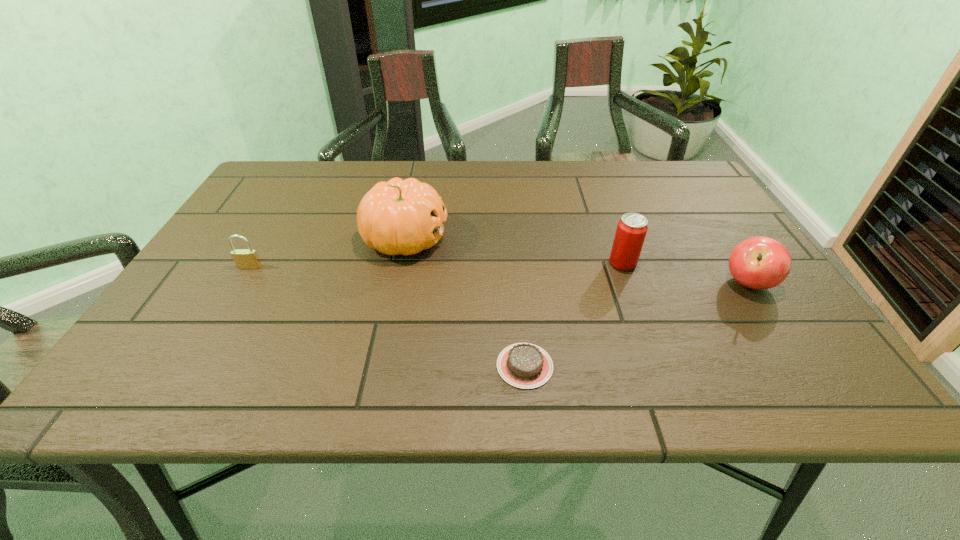
Where is `free space between the fourth object from left to right and the padlock`? Image resolution: width=960 pixels, height=540 pixels. free space between the fourth object from left to right and the padlock is located at coordinates (436, 265).

The width and height of the screenshot is (960, 540). Identify the location of free space between the fourth object from left to right and the rightmost object. (685, 273).

This screenshot has width=960, height=540. Identify the location of unoccupied position between the second shortest object and the rightmost object. (499, 275).

Locate an element on the screen. vacant area between the apple and the fourth object from left to right is located at coordinates (685, 273).

Locate an element on the screen. The height and width of the screenshot is (540, 960). free space between the nearest object and the apple is located at coordinates (636, 325).

At what (x,y) coordinates should I click in order to perform the action: click on empty space that is in between the pumpkin and the shortest object. Please return your answer as a coordinate pair (x, y). Looking at the image, I should click on (465, 302).

Where is `free spot between the shortest object and the fourth object from left to right`? free spot between the shortest object and the fourth object from left to right is located at coordinates (574, 314).

This screenshot has width=960, height=540. Identify the location of free space that is in between the can and the pumpkin. (514, 251).

Find the location of a particular element. The image size is (960, 540). vacant point located between the tallest object and the nearest object is located at coordinates (465, 302).

This screenshot has height=540, width=960. I want to click on vacant region between the apple and the second shortest object, so click(x=499, y=275).